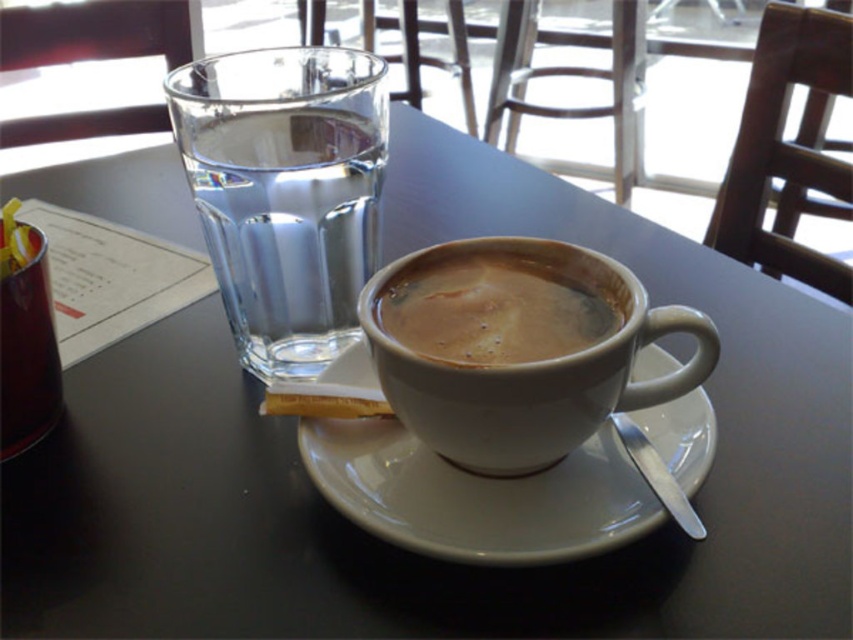
You are a barista who needs to place a new sugar packet on the table. The sugar packet is 5 cm tall. The table has limited space between the clear glass water at upper left and the white matte mug at center. Can you fit the sugar packet between them vertically?

The clear glass water at upper left is much taller than the white matte mug at center, so the vertical space between them is sufficient to fit the 5 cm tall sugar packet.

You are a customer sitting at the table in the cozy cafe. You want to reach for the brown matte cup at center without knocking over the white ceramic saucer at center. Which object should you move first?

The white ceramic saucer at center is closer to you than the brown matte cup at center. To avoid knocking over the saucer, you should move the brown matte cup at center first by carefully lifting it from underneath, as it is further away and requires reaching past the saucer.

You are a barista trying to place a new sugar packet on the table. The white ceramic saucer at center is located at coordinates point 0.777, 0.562. Where should you place the sugar packet to ensure it is on the table but not overlapping with the saucer?

The sugar packet should be placed on the table at a location different from the coordinates point (479, 497) where the white ceramic saucer at center is located.